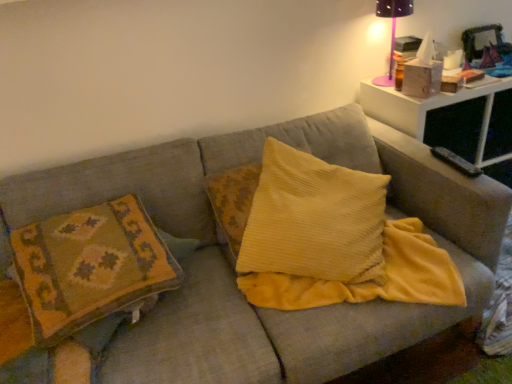
Question: Can you confirm if white plastic table at upper right is shorter than yellow corduroy pillow at center, the second pillow from the left?

Choices:
 (A) no
 (B) yes

Answer: (A)

Question: Considering the relative positions of white plastic table at upper right and yellow corduroy pillow at center, the second pillow from the left, in the image provided, is white plastic table at upper right to the right of yellow corduroy pillow at center, the second pillow from the left, from the viewer's perspective?

Choices:
 (A) yes
 (B) no

Answer: (A)

Question: Can you confirm if white plastic table at upper right is wider than yellow corduroy pillow at center, the second pillow from the left?

Choices:
 (A) no
 (B) yes

Answer: (A)

Question: Considering the relative sizes of white plastic table at upper right and yellow corduroy pillow at center, the second pillow from the left, in the image provided, is white plastic table at upper right bigger than yellow corduroy pillow at center, the second pillow from the left,?

Choices:
 (A) yes
 (B) no

Answer: (A)

Question: Considering the relative sizes of white plastic table at upper right and yellow corduroy pillow at center, the second pillow from the left, in the image provided, is white plastic table at upper right smaller than yellow corduroy pillow at center, the second pillow from the left,?

Choices:
 (A) no
 (B) yes

Answer: (A)

Question: From the image's perspective, is white plastic table at upper right below yellow corduroy pillow at center, the second pillow from the left?

Choices:
 (A) yes
 (B) no

Answer: (B)

Question: Is textured fabric couch at center smaller than white plastic table at upper right?

Choices:
 (A) yes
 (B) no

Answer: (B)

Question: Is textured fabric couch at center wider than white plastic table at upper right?

Choices:
 (A) yes
 (B) no

Answer: (A)

Question: From the image's perspective, is textured fabric couch at center located beneath white plastic table at upper right?

Choices:
 (A) yes
 (B) no

Answer: (A)

Question: Is textured fabric couch at center outside of white plastic table at upper right?

Choices:
 (A) yes
 (B) no

Answer: (A)

Question: Does textured fabric couch at center lie behind white plastic table at upper right?

Choices:
 (A) yes
 (B) no

Answer: (B)

Question: From a real-world perspective, is textured fabric couch at center positioned under white plastic table at upper right based on gravity?

Choices:
 (A) yes
 (B) no

Answer: (A)

Question: From the image's perspective, is textured fabric couch at center beneath pink plastic table lamp at upper right?

Choices:
 (A) yes
 (B) no

Answer: (A)